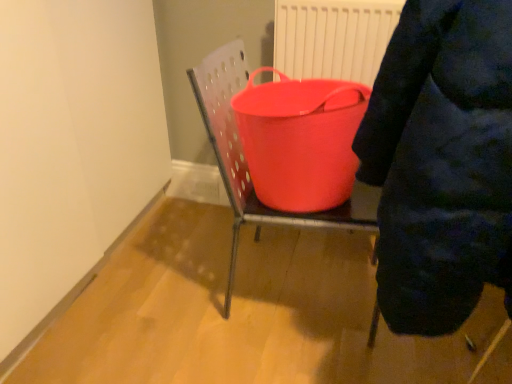
Question: Does rubberized plastic bucket at center have a lesser height compared to dark blue puffer jacket at upper right?

Choices:
 (A) no
 (B) yes

Answer: (B)

Question: Is rubberized plastic bucket at center taller than dark blue puffer jacket at upper right?

Choices:
 (A) no
 (B) yes

Answer: (A)

Question: Is rubberized plastic bucket at center turned away from dark blue puffer jacket at upper right?

Choices:
 (A) no
 (B) yes

Answer: (A)

Question: Does rubberized plastic bucket at center have a larger size compared to dark blue puffer jacket at upper right?

Choices:
 (A) no
 (B) yes

Answer: (A)

Question: Is rubberized plastic bucket at center positioned beyond the bounds of dark blue puffer jacket at upper right?

Choices:
 (A) yes
 (B) no

Answer: (A)

Question: Does rubberized plastic bucket at center have a lesser width compared to dark blue puffer jacket at upper right?

Choices:
 (A) yes
 (B) no

Answer: (A)

Question: Can you confirm if dark blue puffer jacket at upper right is wider than rubberized red bucket at center?

Choices:
 (A) no
 (B) yes

Answer: (B)

Question: Is dark blue puffer jacket at upper right at the right side of rubberized red bucket at center?

Choices:
 (A) no
 (B) yes

Answer: (B)

Question: Is the position of dark blue puffer jacket at upper right more distant than that of rubberized red bucket at center?

Choices:
 (A) yes
 (B) no

Answer: (B)

Question: From the image's perspective, does dark blue puffer jacket at upper right appear lower than rubberized red bucket at center?

Choices:
 (A) no
 (B) yes

Answer: (B)

Question: Considering the relative positions of dark blue puffer jacket at upper right and rubberized red bucket at center in the image provided, is dark blue puffer jacket at upper right in front of rubberized red bucket at center?

Choices:
 (A) yes
 (B) no

Answer: (A)

Question: Would you say dark blue puffer jacket at upper right contains rubberized red bucket at center?

Choices:
 (A) yes
 (B) no

Answer: (B)

Question: From the image's perspective, is rubberized plastic bucket at center under rubberized red bucket at center?

Choices:
 (A) yes
 (B) no

Answer: (A)